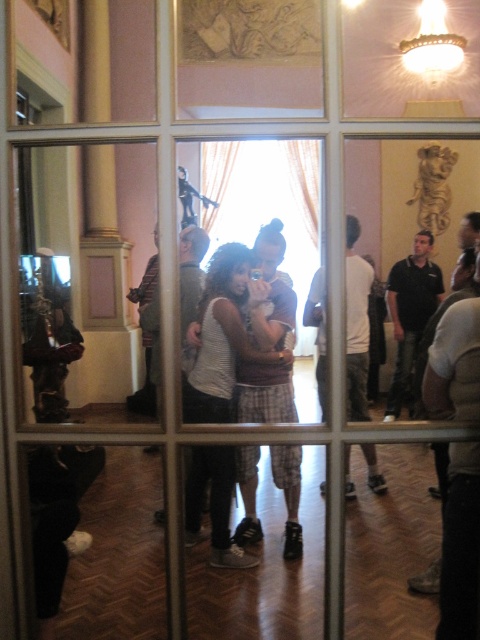
You are standing in the room and want to take a photo of the black cotton shirt at center without the white cotton shirt at center blocking it. How can you adjust your position to achieve this?

The white cotton shirt at center is closer to the viewer than the black cotton shirt at center. To avoid the white cotton shirt blocking the view, you should move to a position where you can see behind or around the white cotton shirt, perhaps by stepping to the side or moving further back to create a line of sight past it.

You are standing in the room and want to hand a document to both the white cotton shirt at center and the black cotton shirt at center without moving. Can you place the document somewhere between them so both can reach it easily?

The white cotton shirt at center and black cotton shirt at center are 4.00 feet apart from each other. To ensure both can reach the document easily, place it midway between them, approximately 2.00 feet from each person.